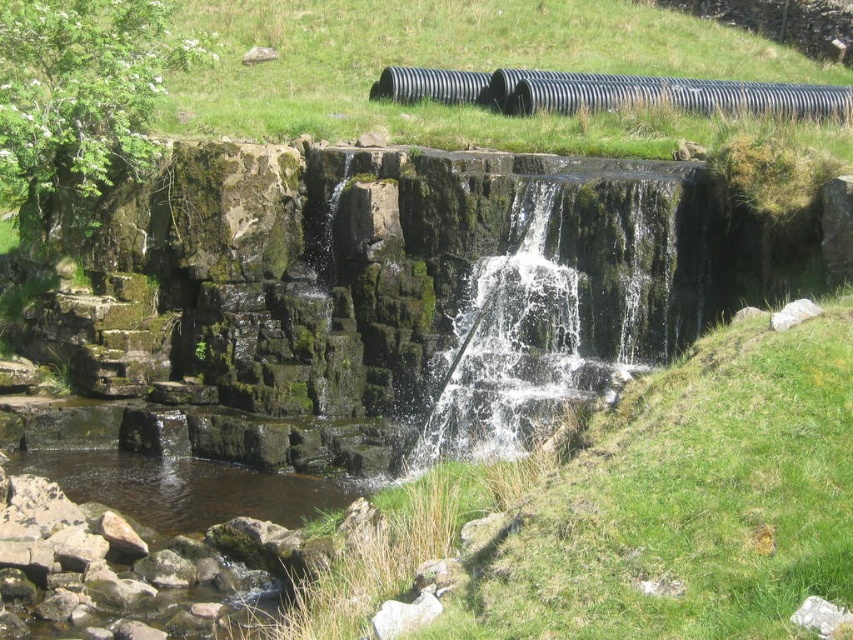
Does clear water at center have a greater height compared to clear water at lower left?

Yes, clear water at center is taller than clear water at lower left.

Can you confirm if clear water at center is shorter than clear water at lower left?

In fact, clear water at center may be taller than clear water at lower left.

Where is `clear water at center`? This screenshot has height=640, width=853. clear water at center is located at coordinates (514, 348).

Is clear water at center below black rubber water pipe at upper center?

Yes.

Is point (521, 292) closer to camera compared to point (480, 100)?

Yes.

Identify the location of clear water at center. The image size is (853, 640). (514, 348).

Find the location of `clear water at center`. clear water at center is located at coordinates (514, 348).

Can you confirm if clear water at lower left is smaller than black rubber water pipe at upper center?

→ Indeed, clear water at lower left has a smaller size compared to black rubber water pipe at upper center.

Where is `clear water at lower left`? clear water at lower left is located at coordinates (187, 488).